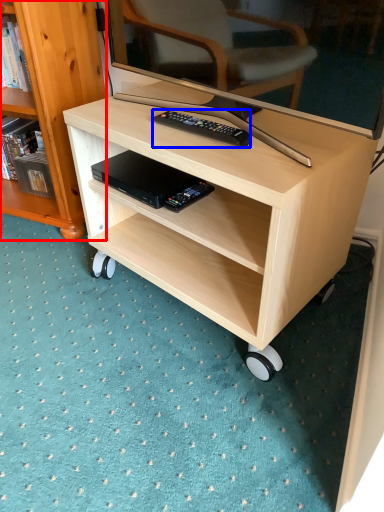
Question: Among these objects, which one is nearest to the camera, bookcase (highlighted by a red box) or remote control (highlighted by a blue box)?

Choices:
 (A) bookcase
 (B) remote control

Answer: (B)